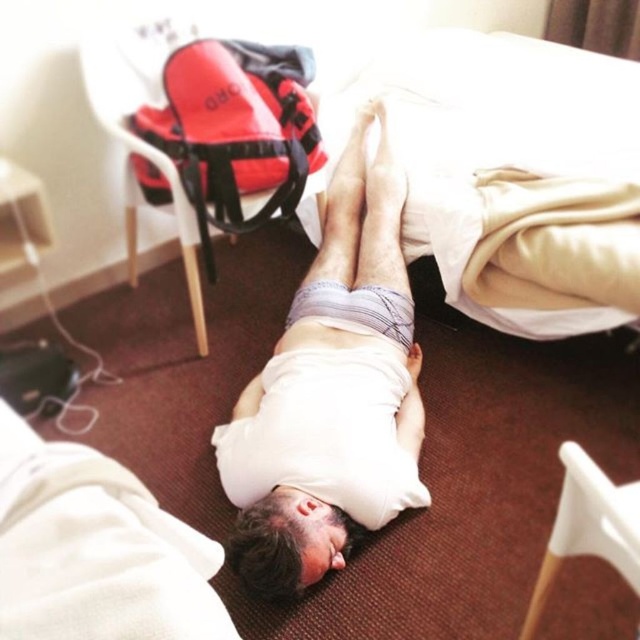
Is white soft bed at upper center positioned in front of white cotton shirt at center?

No, it is not.

Is white soft bed at upper center wider than white cotton shirt at center?

Yes.

Is point (436, 141) closer to viewer compared to point (280, 564)?

No, it is behind (280, 564).

Find the location of a particular element. This screenshot has height=640, width=640. white soft bed at upper center is located at coordinates (509, 176).